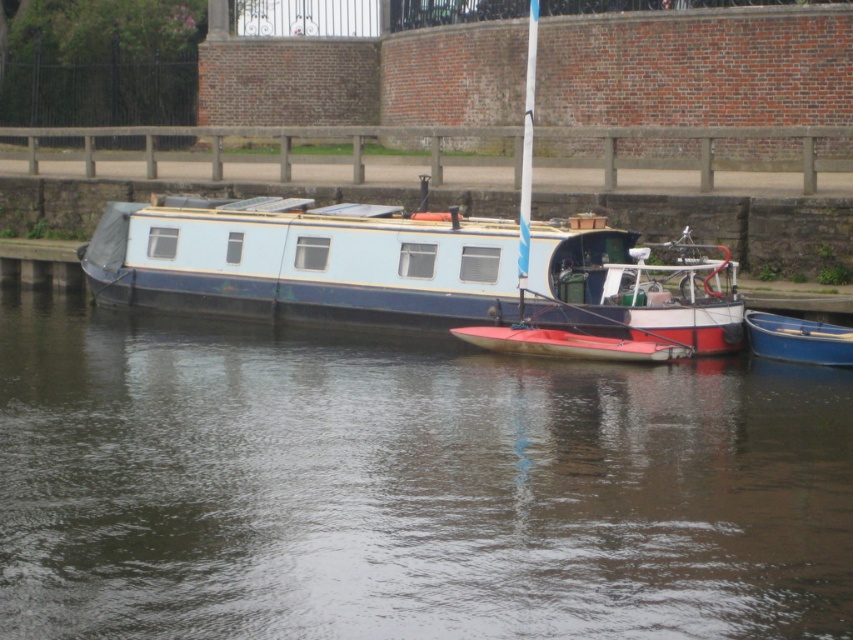
You are a delivery person needing to move a package from the red matte dinghy at center to the blue plastic boat at lower right. What is the minimum distance you need to travel?

The minimum distance you need to travel is 1.28 meters between the red matte dinghy at center and the blue plastic boat at lower right.

In the scene shown: You are planning to sail a toy boat on the water in the scene. The toy boat requires a water surface area of at least 1 meter squared. Based on the smooth water at center and the blue plastic boat at lower right, can you determine if the water surface is large enough?

The smooth water at center is bigger than blue plastic boat at lower right. Since the blue plastic boat at lower right is tied up and the water area is larger, it is likely that the water surface at center is sufficient to accommodate a toy boat requiring 1 meter squared area.